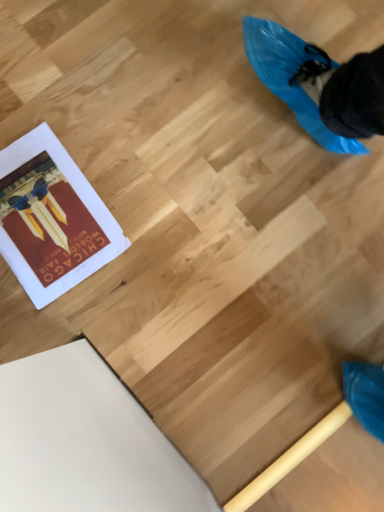
Find the location of `empty space that is to the right of matte paper poster at lower left`. empty space that is to the right of matte paper poster at lower left is located at coordinates click(x=163, y=231).